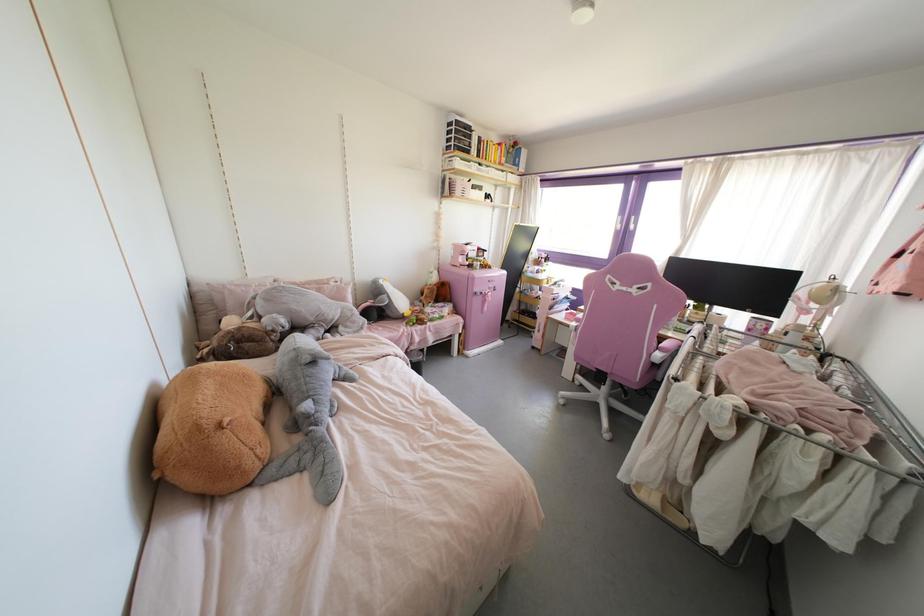
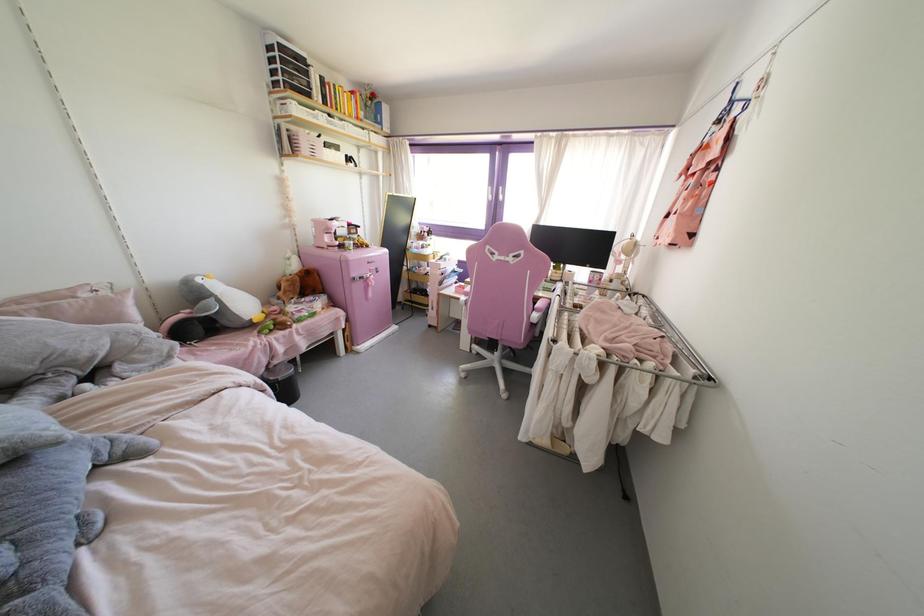
Where in the second image is the point corresponding to point (327, 358) from the first image?

(57, 442)